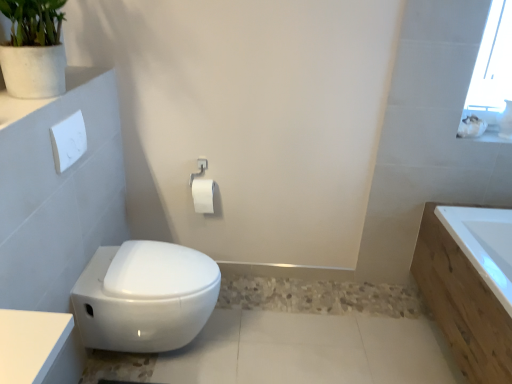
Question: From the image's perspective, is white glossy bidet at lower left located above or below white wood bathtub at right?

Choices:
 (A) below
 (B) above

Answer: (B)

Question: Is white glossy bidet at lower left taller or shorter than white wood bathtub at right?

Choices:
 (A) tall
 (B) short

Answer: (B)

Question: Considering the real-world distances, which object is farthest from the white glossy bidet at lower left?

Choices:
 (A) white wood bathtub at right
 (B) white glossy ledge at upper left
 (C) white matte toilet paper at center

Answer: (A)

Question: Considering the real-world distances, which object is closest to the white matte toilet paper at center?

Choices:
 (A) white glossy bidet at lower left
 (B) white wood bathtub at right
 (C) white glossy ledge at upper left

Answer: (A)